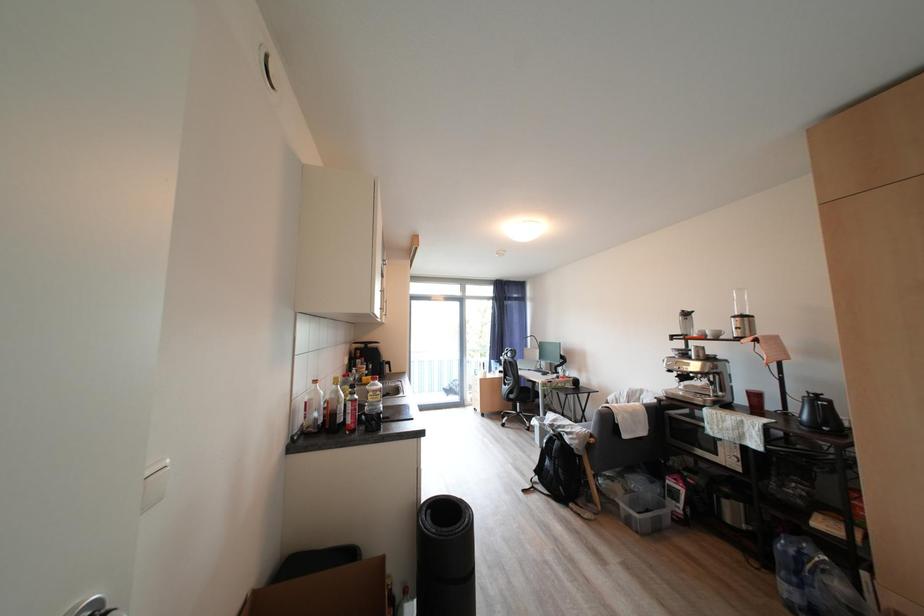
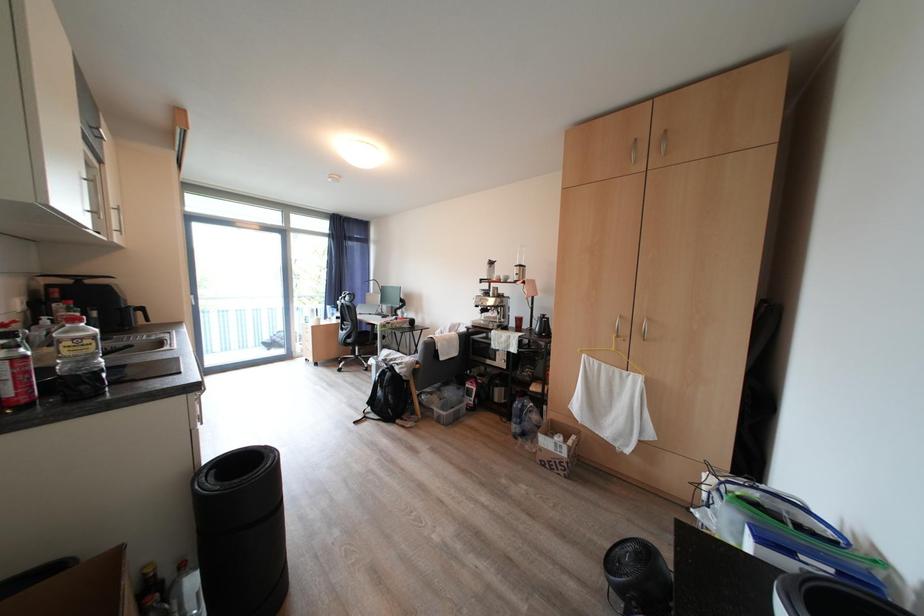
Question: How did the camera likely rotate?

Choices:
 (A) Left
 (B) Right
 (C) Up
 (D) Down

Answer: (B)